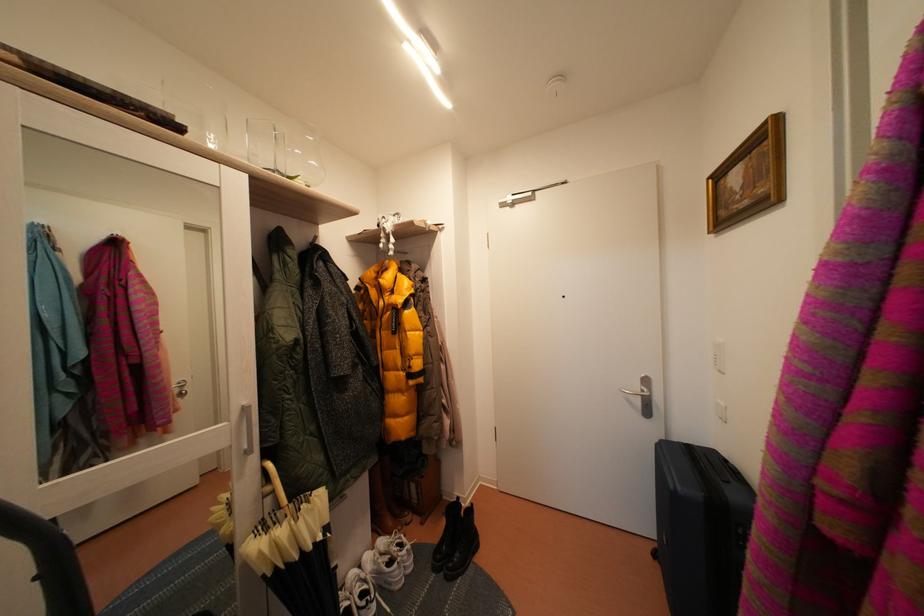
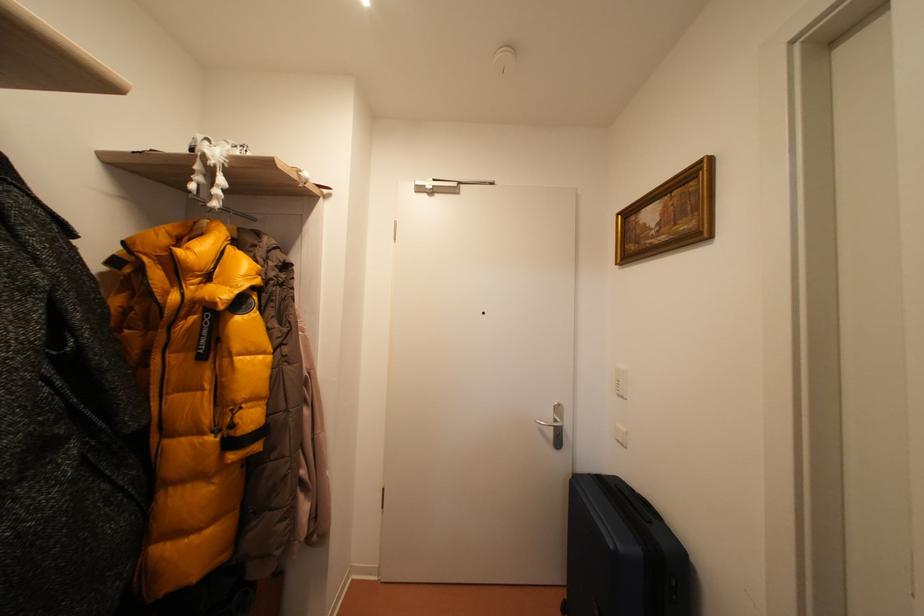
Question: Which direction would the cameraman need to move to produce the second image? Reply with the corresponding letter.

Choices:
 (A) Left
 (B) Right
 (C) Forward
 (D) Backward

Answer: (C)